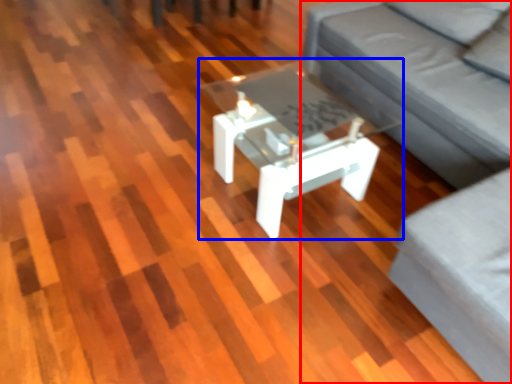
Question: Which of the following is the closest to the observer, studio couch (highlighted by a red box) or coffee table (highlighted by a blue box)?

Choices:
 (A) studio couch
 (B) coffee table

Answer: (A)